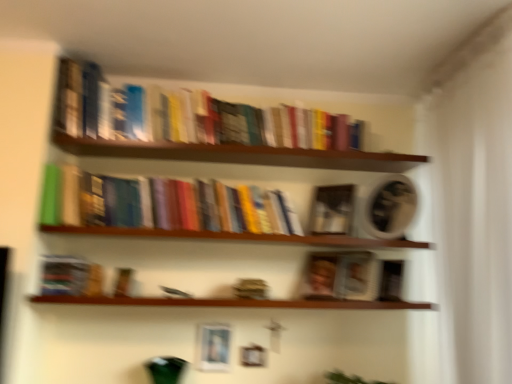
Describe the element at coordinates (213, 347) in the screenshot. The image size is (512, 384). I see `matte silver picture frame at lower center` at that location.

This screenshot has height=384, width=512. What are the coordinates of `matte black book at center, which ranks as the 1th paperback book in top-to-bottom order` in the screenshot? It's located at (332, 210).

Describe the element at coordinates (332, 210) in the screenshot. The width and height of the screenshot is (512, 384). I see `matte black book at center, which ranks as the 1th paperback book in top-to-bottom order` at that location.

What are the coordinates of `wooden shelf at center, which is counted as the first window sill, starting from the top` in the screenshot? It's located at (239, 237).

The height and width of the screenshot is (384, 512). In order to click on matte brown book at center, acting as the 2th paperback book starting from the left in this screenshot , I will do `click(391, 280)`.

Identify the location of hardcover books at center. The width and height of the screenshot is (512, 384). (162, 204).

At what (x,y) coordinates should I click in order to perform the action: click on wooden shelf at lower center, the first window sill in the bottom-to-top sequence. Please return your answer as a coordinate pair (x, y). This screenshot has width=512, height=384. Looking at the image, I should click on (233, 302).

Considering the sizes of objects wooden shelf at lower center, which is the 2th window sill in top-to-bottom order, and wooden books at upper center in the image provided, who is thinner, wooden shelf at lower center, which is the 2th window sill in top-to-bottom order, or wooden books at upper center?

wooden shelf at lower center, which is the 2th window sill in top-to-bottom order, is thinner.

From a real-world perspective, is wooden shelf at lower center, which is the 2th window sill in top-to-bottom order, physically located above or below wooden books at upper center?

In terms of real-world spatial position, wooden shelf at lower center, which is the 2th window sill in top-to-bottom order, is below wooden books at upper center.

Locate an element on the screen. This screenshot has width=512, height=384. shelf above the wooden shelf at lower center, the first window sill in the bottom-to-top sequence (from the image's perspective) is located at coordinates (240, 154).

From the image's perspective, is wooden shelf at lower center, which is the 2th window sill in top-to-bottom order, over wooden books at upper center?

No, from the image's perspective, wooden shelf at lower center, which is the 2th window sill in top-to-bottom order, is not above wooden books at upper center.

How distant is wooden books at upper center from matte black book at center, positioned as the first paperback book in left-to-right order?

A distance of 11.53 inches exists between wooden books at upper center and matte black book at center, positioned as the first paperback book in left-to-right order.

Is wooden books at upper center facing towards matte black book at center, the second paperback book in the bottom-to-top sequence?

No.

Considering the relative sizes of wooden books at upper center and matte black book at center, which ranks as the 1th paperback book in top-to-bottom order, in the image provided, is wooden books at upper center smaller than matte black book at center, which ranks as the 1th paperback book in top-to-bottom order,?

Incorrect, wooden books at upper center is not smaller in size than matte black book at center, which ranks as the 1th paperback book in top-to-bottom order.

The image size is (512, 384). What are the coordinates of `shelf in front of the matte black book at center, positioned as the second paperback book in right-to-left order` in the screenshot? It's located at (240, 154).

Which is more to the right, matte brown book at center, acting as the 2th paperback book starting from the left, or wooden shelf at lower center, which is the 2th window sill in top-to-bottom order?

Positioned to the right is matte brown book at center, acting as the 2th paperback book starting from the left.

Does matte brown book at center, the first paperback book from the right, have a lesser width compared to wooden shelf at lower center, which is the 2th window sill in top-to-bottom order?

Indeed, matte brown book at center, the first paperback book from the right, has a lesser width compared to wooden shelf at lower center, which is the 2th window sill in top-to-bottom order.

Considering the relative positions of matte brown book at center, marked as the 2th paperback book in a top-to-bottom arrangement, and wooden shelf at lower center, the first window sill in the bottom-to-top sequence, in the image provided, is matte brown book at center, marked as the 2th paperback book in a top-to-bottom arrangement, in front of wooden shelf at lower center, the first window sill in the bottom-to-top sequence,?

No, it is not.

Does matte brown book at center, the first paperback book from the right, turn towards wooden shelf at lower center, which is the 2th window sill in top-to-bottom order?

No, matte brown book at center, the first paperback book from the right, is not facing towards wooden shelf at lower center, which is the 2th window sill in top-to-bottom order.

Which is less distant, (120, 211) or (210, 338)?

Point (120, 211) is positioned closer to the camera compared to point (210, 338).

Is hardcover books at center far from matte silver picture frame at lower center?

hardcover books at center is actually quite close to matte silver picture frame at lower center.

In the scene shown: From the image's perspective, is hardcover books at center located beneath matte silver picture frame at lower center?

No, from the image's perspective, hardcover books at center is not below matte silver picture frame at lower center.

Which is in front, matte silver picture frame at lower center or matte black book at center, positioned as the second paperback book in right-to-left order?

Positioned in front is matte black book at center, positioned as the second paperback book in right-to-left order.

Considering the sizes of objects matte silver picture frame at lower center and matte black book at center, the second paperback book in the bottom-to-top sequence, in the image provided, who is wider, matte silver picture frame at lower center or matte black book at center, the second paperback book in the bottom-to-top sequence,?

matte black book at center, the second paperback book in the bottom-to-top sequence.

Find the location of a particular element. The height and width of the screenshot is (384, 512). picture frame that appears below the matte black book at center, positioned as the first paperback book in left-to-right order (from a real-world perspective) is located at coordinates (213, 347).

Is point (200, 348) closer to viewer compared to point (341, 204)?

That is True.

From a real-world perspective, is matte black book at center, positioned as the first paperback book in left-to-right order, under wooden books at upper center?

Yes, from a real-world perspective, matte black book at center, positioned as the first paperback book in left-to-right order, is beneath wooden books at upper center.

Is matte black book at center, positioned as the second paperback book in right-to-left order, not inside wooden books at upper center?

Yes, matte black book at center, positioned as the second paperback book in right-to-left order, is located beyond the bounds of wooden books at upper center.

Is matte black book at center, positioned as the first paperback book in left-to-right order, facing towards wooden books at upper center?

No, matte black book at center, positioned as the first paperback book in left-to-right order, is not turned towards wooden books at upper center.

Is matte black book at center, positioned as the first paperback book in left-to-right order, to the left or to the right of wooden books at upper center in the image?

From the image, it's evident that matte black book at center, positioned as the first paperback book in left-to-right order, is to the right of wooden books at upper center.

Is matte black book at center, positioned as the second paperback book in right-to-left order, not near matte brown book at center, marked as the first paperback book in a bottom-to-top arrangement?

matte black book at center, positioned as the second paperback book in right-to-left order, is near matte brown book at center, marked as the first paperback book in a bottom-to-top arrangement, not far away.

How distant is matte black book at center, positioned as the second paperback book in right-to-left order, from matte brown book at center, acting as the 2th paperback book starting from the left?

The distance of matte black book at center, positioned as the second paperback book in right-to-left order, from matte brown book at center, acting as the 2th paperback book starting from the left, is 12.21 inches.

Considering the relative sizes of matte black book at center, the second paperback book in the bottom-to-top sequence, and matte brown book at center, acting as the 2th paperback book starting from the left, in the image provided, is matte black book at center, the second paperback book in the bottom-to-top sequence, taller than matte brown book at center, acting as the 2th paperback book starting from the left,?

Yes.

At what (x,y) coordinates should I click in order to perform the action: click on paperback book below the matte black book at center, positioned as the second paperback book in right-to-left order (from a real-world perspective). Please return your answer as a coordinate pair (x, y). The width and height of the screenshot is (512, 384). Looking at the image, I should click on (391, 280).

This screenshot has width=512, height=384. Identify the location of the 1st window sill counting from the left side of the wooden books at upper center. (233, 302).

There is a wooden books at upper center. Identify the location of the 1st paperback book below it (from the image's perspective). This screenshot has width=512, height=384. (332, 210).

Looking at the image, which one is located closer to wooden shelf at lower center, the first window sill in the bottom-to-top sequence, matte silver picture frame at lower center or wooden books at upper center?

matte silver picture frame at lower center.

Considering their positions, is wooden shelf at center, acting as the second window sill starting from the bottom, positioned closer to wooden books at upper center than matte black book at center, which ranks as the 1th paperback book in top-to-bottom order?

The object closer to wooden books at upper center is matte black book at center, which ranks as the 1th paperback book in top-to-bottom order.

Considering their positions, is wooden shelf at center, which is counted as the first window sill, starting from the top, positioned closer to matte black book at center, positioned as the first paperback book in left-to-right order, than matte silver picture frame at lower center?

wooden shelf at center, which is counted as the first window sill, starting from the top, is positioned closer to the anchor matte black book at center, positioned as the first paperback book in left-to-right order.

Considering their positions, is hardcover books at center positioned closer to matte silver picture frame at lower center than matte brown book at center, the first paperback book from the right?

hardcover books at center is positioned closer to the anchor matte silver picture frame at lower center.

Consider the image. Looking at the image, which one is located further to hardcover books at center, matte silver picture frame at lower center or wooden shelf at center, acting as the second window sill starting from the bottom?

matte silver picture frame at lower center lies further to hardcover books at center than the other object.

From the image, which object appears to be farther from wooden shelf at center, acting as the second window sill starting from the bottom, wooden shelf at lower center, which is the 2th window sill in top-to-bottom order, or matte brown book at center, the first paperback book from the right?

The object further to wooden shelf at center, acting as the second window sill starting from the bottom, is matte brown book at center, the first paperback book from the right.

Based on the photo, estimate the real-world distances between objects in this image. Which object is further from wooden shelf at center, acting as the second window sill starting from the bottom, matte brown book at center, acting as the 2th paperback book starting from the left, or wooden books at upper center?

Based on the image, matte brown book at center, acting as the 2th paperback book starting from the left, appears to be further to wooden shelf at center, acting as the second window sill starting from the bottom.

Considering their positions, is matte brown book at center, the first paperback book from the right, positioned further to hardcover books at center than matte black book at center, positioned as the first paperback book in left-to-right order?

matte brown book at center, the first paperback book from the right, is further to hardcover books at center.

You are a GUI agent. You are given a task and a screenshot of the screen. Output one action in this format:
    pyautogui.click(x=<x>, y=<y>)
    Task: Click on the window sill located between wooden shelf at center, acting as the second window sill starting from the bottom, and matte black book at center, the second paperback book in the bottom-to-top sequence, in the left-right direction
    
    Given the screenshot: What is the action you would take?
    pyautogui.click(x=233, y=302)

This screenshot has width=512, height=384. I want to click on window sill between hardcover books at center and wooden shelf at lower center, the first window sill in the bottom-to-top sequence, from top to bottom, so pos(239,237).

Locate an element on the screen. paperback book between matte silver picture frame at lower center and matte brown book at center, marked as the 2th paperback book in a top-to-bottom arrangement, from left to right is located at coordinates (332, 210).

This screenshot has width=512, height=384. What are the coordinates of `paperback book situated between wooden shelf at lower center, the first window sill in the bottom-to-top sequence, and matte brown book at center, the first paperback book from the right, from left to right` in the screenshot? It's located at (332, 210).